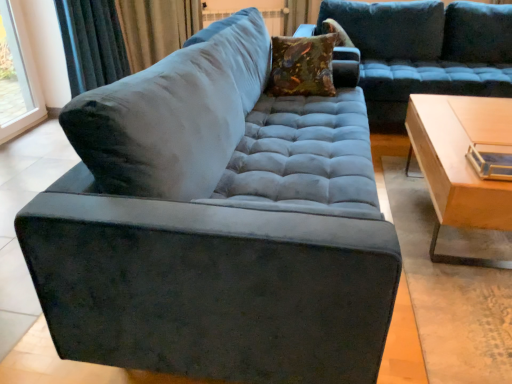
Question: Based on their positions, is velvet floral pillow at center, placed as the 2th pillow when sorted from top to bottom, located to the left or right of transparent glass window at upper left?

Choices:
 (A) right
 (B) left

Answer: (A)

Question: Relative to transparent glass window at upper left, is velvet floral pillow at center, which is counted as the 1th pillow, starting from the left, in front or behind?

Choices:
 (A) behind
 (B) front

Answer: (B)

Question: Considering the real-world distances, which object is farthest from the velvet floral pillow at center, which is counted as the 1th pillow, starting from the left?

Choices:
 (A) transparent glass window at upper left
 (B) velvet curtain at upper left
 (C) light wood/wooden table at right
 (D) velvet-like brown pillow at upper center, marked as the second pillow in a bottom-to-top arrangement
 (E) velvet blue couch at upper center

Answer: (A)

Question: Which object is positioned farthest from the transparent glass window at upper left?

Choices:
 (A) velvet curtain at upper left
 (B) velvet-like brown pillow at upper center, which appears as the second pillow when viewed from the front
 (C) velvet blue couch at upper center
 (D) light wood/wooden table at right
 (E) velvet floral pillow at center, positioned as the second pillow in back-to-front order

Answer: (D)